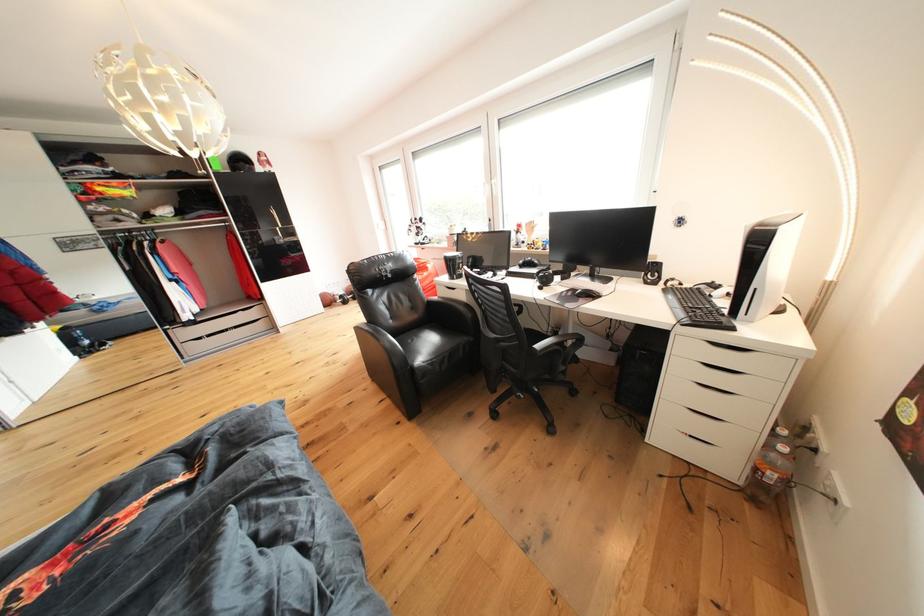
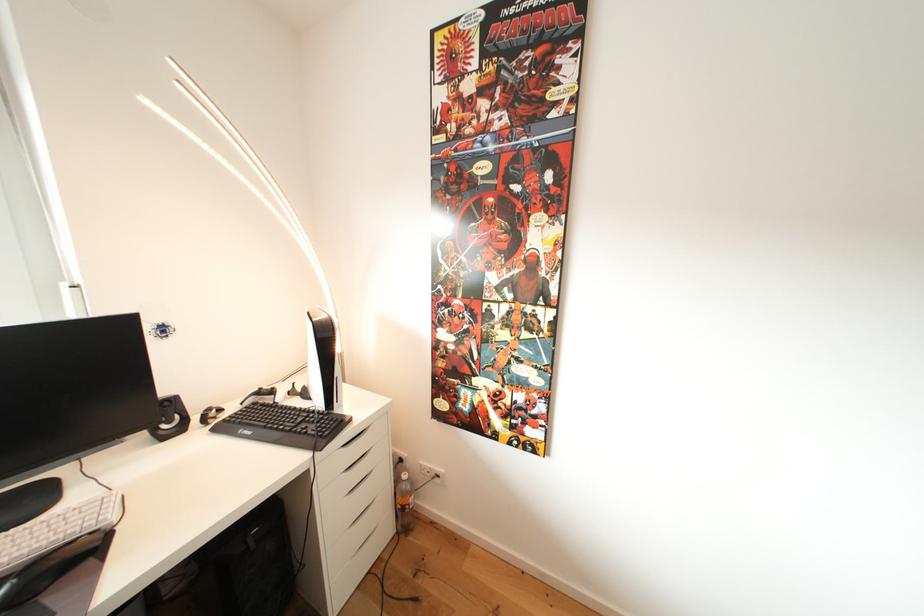
Locate, in the second image, the point that corresponds to (689,289) in the first image.

(228, 415)